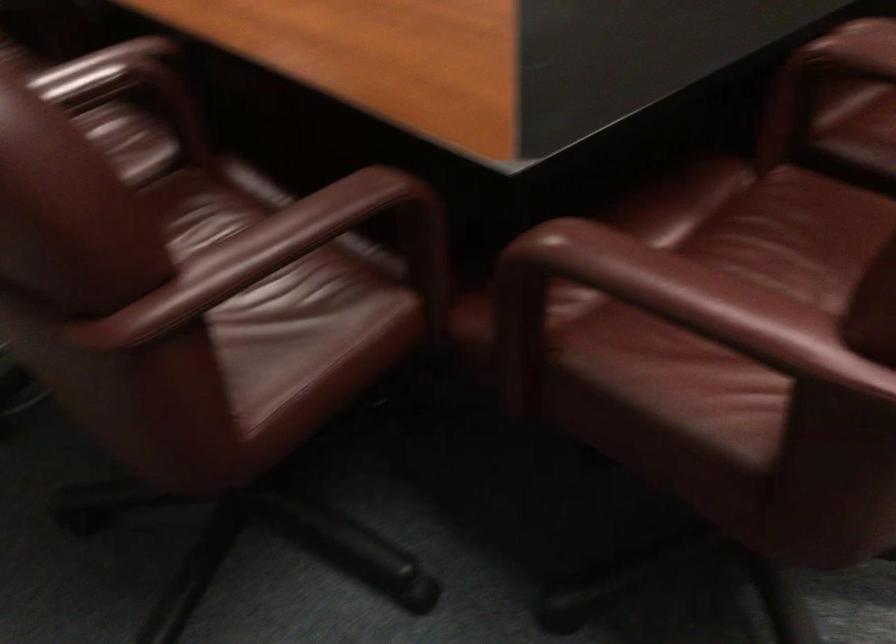
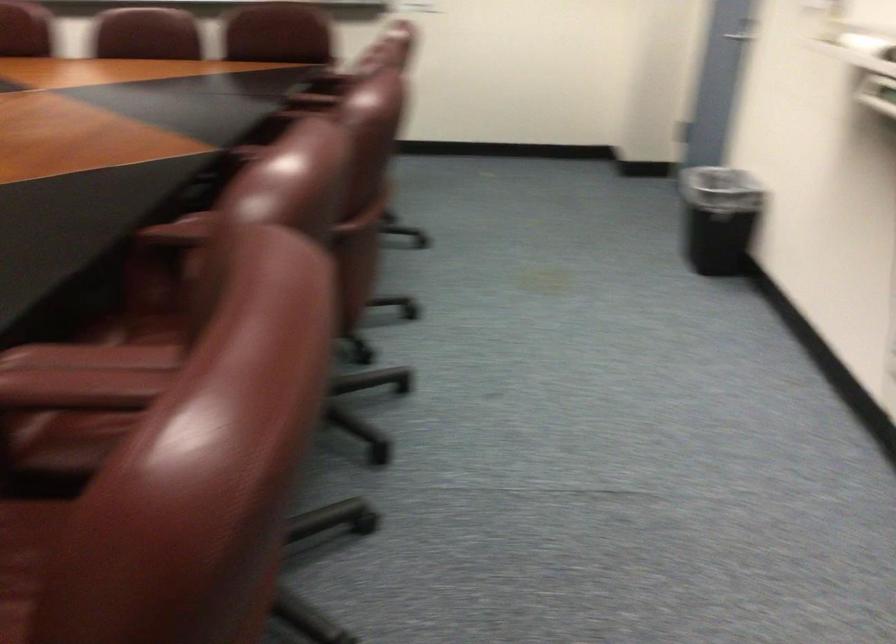
The first image is from the beginning of the video and the second image is from the end. How did the camera likely rotate when shooting the video?

The camera's rotation is toward right-down.